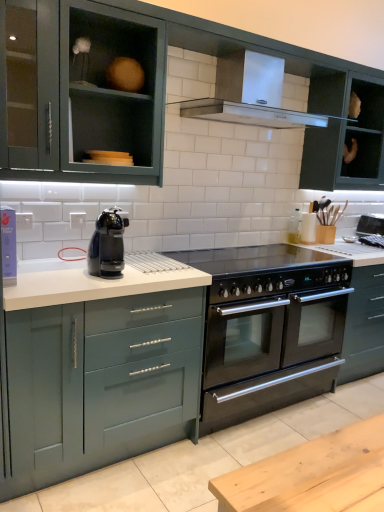
Question: Which direction should I rotate to look at matte green cabinets at upper center, the second cabinetry when ordered from bottom to top, — up or down?

Choices:
 (A) down
 (B) up

Answer: (B)

Question: Is black plastic coffee machine at center closer to camera compared to black glass cooktop at center?

Choices:
 (A) no
 (B) yes

Answer: (B)

Question: Could black glass cooktop at center be considered to be inside black plastic coffee machine at center?

Choices:
 (A) yes
 (B) no

Answer: (B)

Question: Is black plastic coffee machine at center at the left side of black glass cooktop at center?

Choices:
 (A) yes
 (B) no

Answer: (A)

Question: Are black plastic coffee machine at center and black glass cooktop at center making contact?

Choices:
 (A) no
 (B) yes

Answer: (A)

Question: Is black plastic coffee machine at center facing towards black glass cooktop at center?

Choices:
 (A) yes
 (B) no

Answer: (B)

Question: Is black plastic coffee machine at center outside black glass cooktop at center?

Choices:
 (A) yes
 (B) no

Answer: (A)

Question: Is satin silver range hood at upper center facing towards white matte countertop at lower center?

Choices:
 (A) no
 (B) yes

Answer: (A)

Question: Does satin silver range hood at upper center have a greater width compared to white matte countertop at lower center?

Choices:
 (A) no
 (B) yes

Answer: (A)

Question: Is satin silver range hood at upper center further to camera compared to white matte countertop at lower center?

Choices:
 (A) no
 (B) yes

Answer: (B)

Question: Is satin silver range hood at upper center positioned with its back to white matte countertop at lower center?

Choices:
 (A) yes
 (B) no

Answer: (B)

Question: Considering the relative sizes of satin silver range hood at upper center and white matte countertop at lower center in the image provided, is satin silver range hood at upper center taller than white matte countertop at lower center?

Choices:
 (A) yes
 (B) no

Answer: (A)

Question: Does satin silver range hood at upper center lie in front of white matte countertop at lower center?

Choices:
 (A) no
 (B) yes

Answer: (A)

Question: From the image's perspective, is black glass cooktop at center under satin silver range hood at upper center?

Choices:
 (A) yes
 (B) no

Answer: (A)